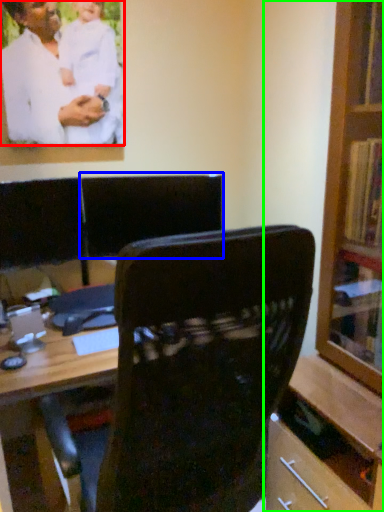
Question: Estimate the real-world distances between objects in this image. Which object is farther from man (highlighted by a red box), armchair (highlighted by a blue box) or bookcase (highlighted by a green box)?

Choices:
 (A) armchair
 (B) bookcase

Answer: (B)